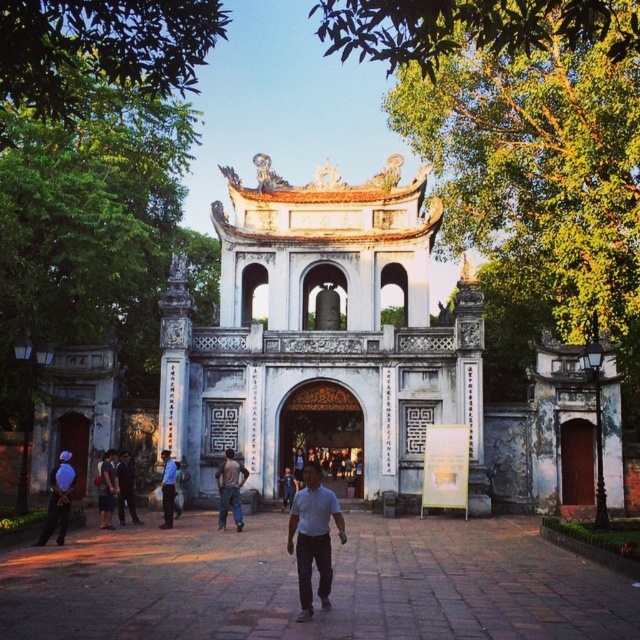
Which is behind, point (61, 529) or point (124, 522)?

Positioned behind is point (124, 522).

Is blue fabric cap at lower left thinner than dark blue shirt at center?

No, blue fabric cap at lower left is not thinner than dark blue shirt at center.

Measure the distance between point (65, 484) and camera.

Point (65, 484) is 63.47 meters away from camera.

At what (x,y) coordinates should I click in order to perform the action: click on blue fabric cap at lower left. Please return your answer as a coordinate pair (x, y). This screenshot has height=640, width=640. Looking at the image, I should click on (58, 499).

Which is in front, point (10, 579) or point (88, 435)?

Point (10, 579) is more forward.

Is brick pavement at center to the right of blue fabric at left from the viewer's perspective?

Correct, you'll find brick pavement at center to the right of blue fabric at left.

Is point (522, 596) positioned before point (83, 426)?

Yes, it is.

The width and height of the screenshot is (640, 640). Identify the location of brick pavement at center. (314, 584).

Is brown wooden gate at center bigger than dark blue jeans at center?

Correct, brown wooden gate at center is larger in size than dark blue jeans at center.

Which is in front, point (321, 458) or point (228, 477)?

Point (228, 477)

Which is in front, point (300, 474) or point (240, 499)?

Point (240, 499)

Identify the location of brown wooden gate at center. This screenshot has height=640, width=640. 323,433.